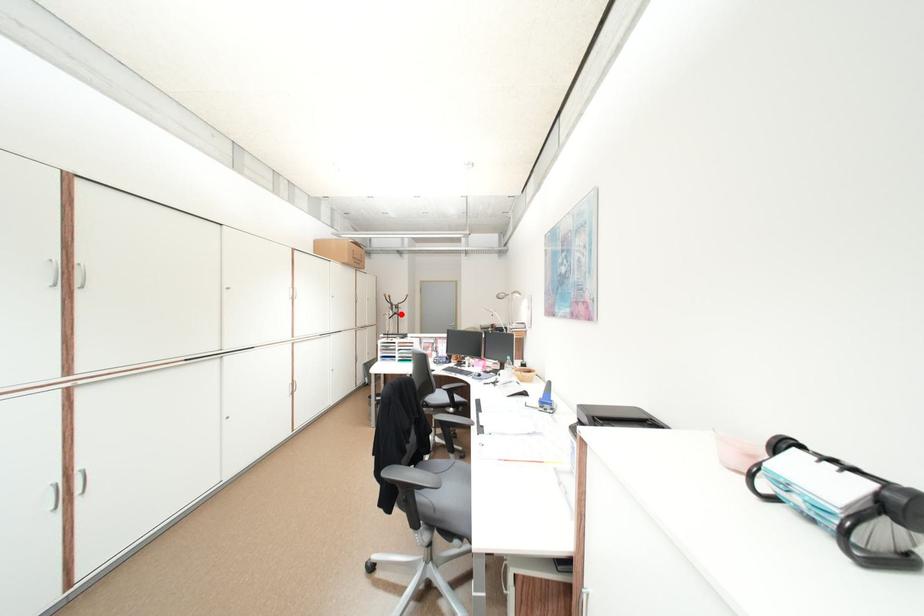
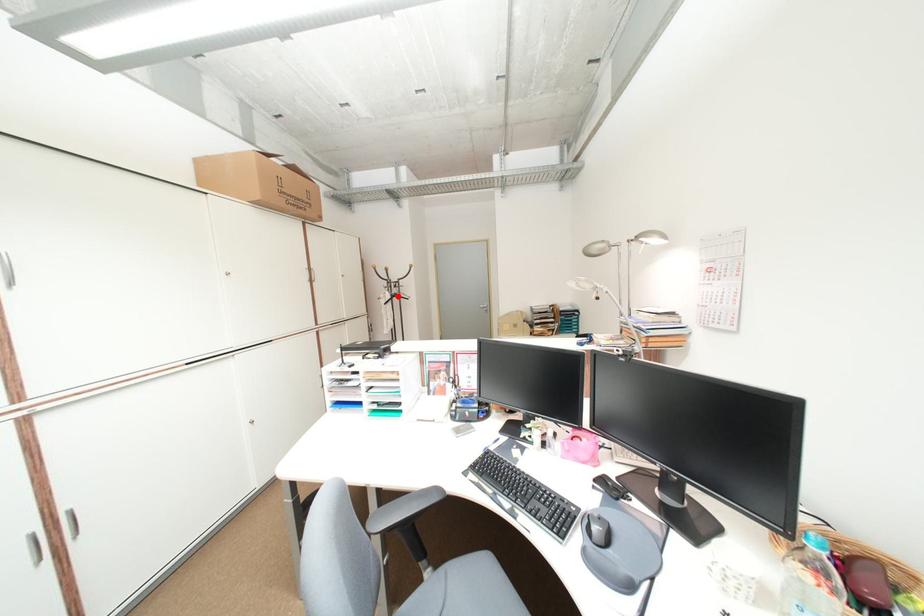
I am providing you with two images of the same scene from different viewpoints. A red point is marked on the first image and another point is marked on the second image. Are the points marked in image1 and image2 representing the same 3D position?

Yes